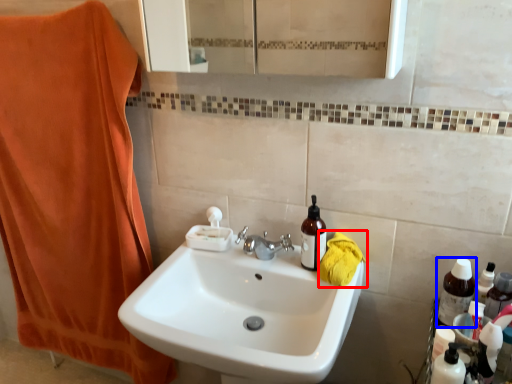
Question: Which point is closer to the camera, beach towel (highlighted by a red box) or bottle (highlighted by a blue box)?

Choices:
 (A) beach towel
 (B) bottle

Answer: (B)